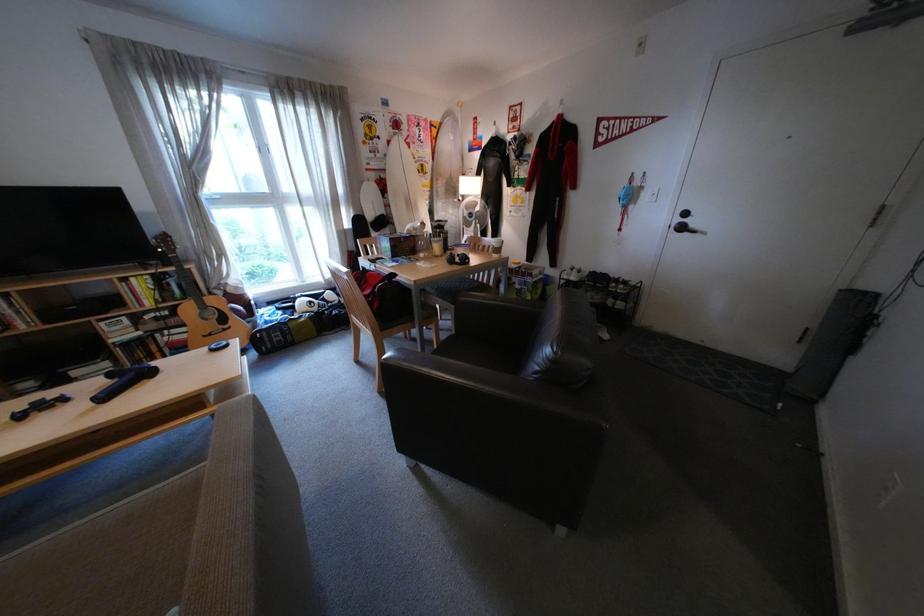
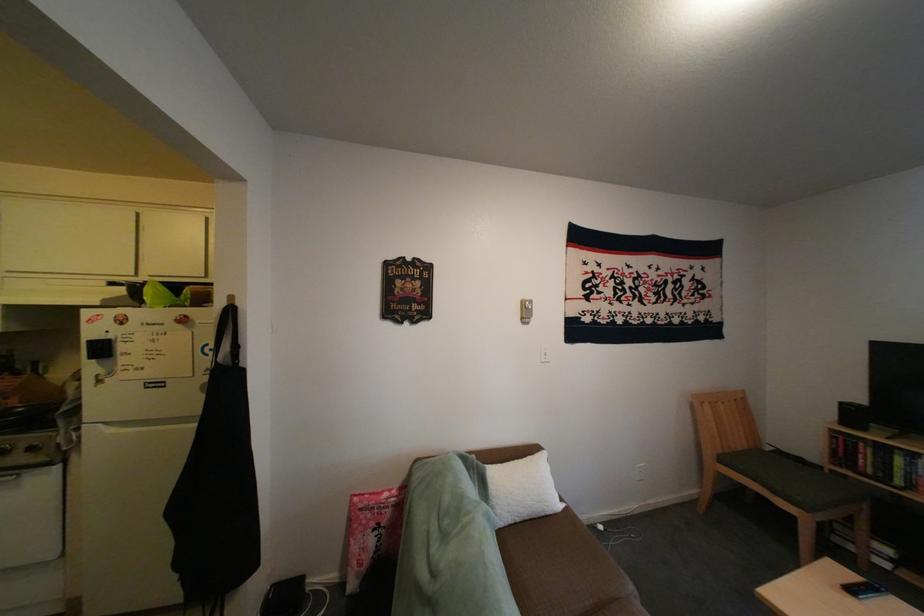
Question: The camera is either moving clockwise (left) or counter-clockwise (right) around the object. The first image is from the beginning of the video and the second image is from the end. Is the camera moving left or right when shooting the video?

Choices:
 (A) Left
 (B) Right

Answer: (B)